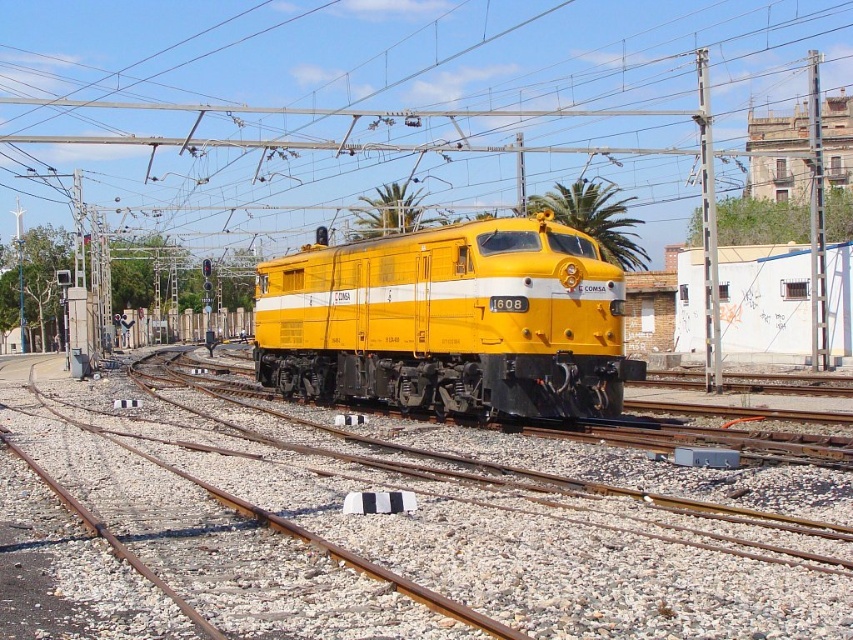
Does metallic wire at center appear on the left side of yellow matte locomotive at center?

In fact, metallic wire at center is to the right of yellow matte locomotive at center.

Who is positioned more to the left, metallic wire at center or yellow matte locomotive at center?

yellow matte locomotive at center

Find the location of `metallic wire at center`. metallic wire at center is located at coordinates (383, 104).

This screenshot has height=640, width=853. What do you see at coordinates (389, 524) in the screenshot?
I see `yellow metal track at center` at bounding box center [389, 524].

Between yellow metal track at center and yellow matte locomotive at center, which one has less height?

yellow metal track at center is shorter.

The width and height of the screenshot is (853, 640). I want to click on yellow metal track at center, so click(389, 524).

The height and width of the screenshot is (640, 853). Find the location of `yellow metal track at center`. yellow metal track at center is located at coordinates [389, 524].

Consider the image. Is yellow metal track at center shorter than metallic wire at center?

Correct, yellow metal track at center is not as tall as metallic wire at center.

Which is in front, point (291, 540) or point (474, 166)?

Point (291, 540) is in front.

Does point (39, 612) come in front of point (128, 180)?

Yes, it is.

Locate an element on the screen. This screenshot has width=853, height=640. yellow metal track at center is located at coordinates coord(389,524).